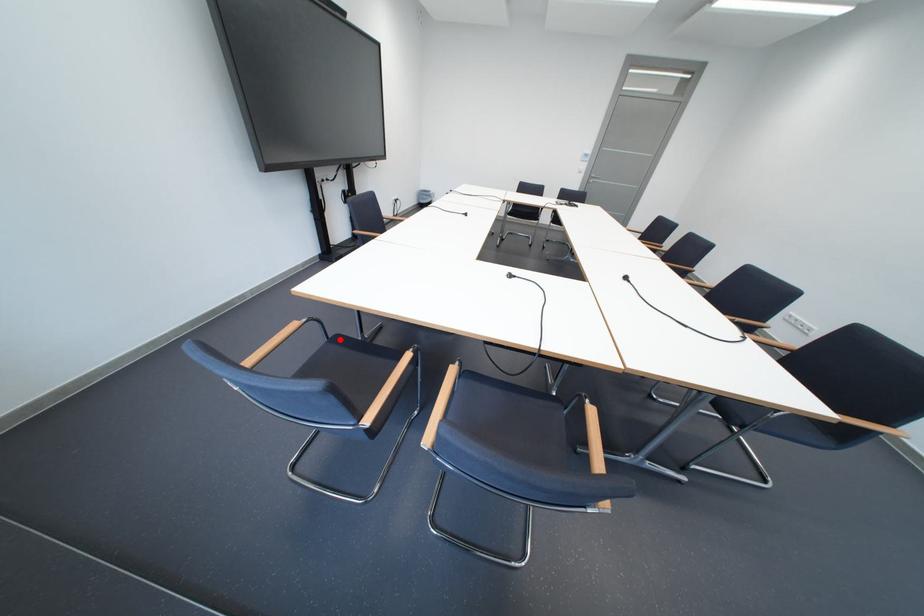
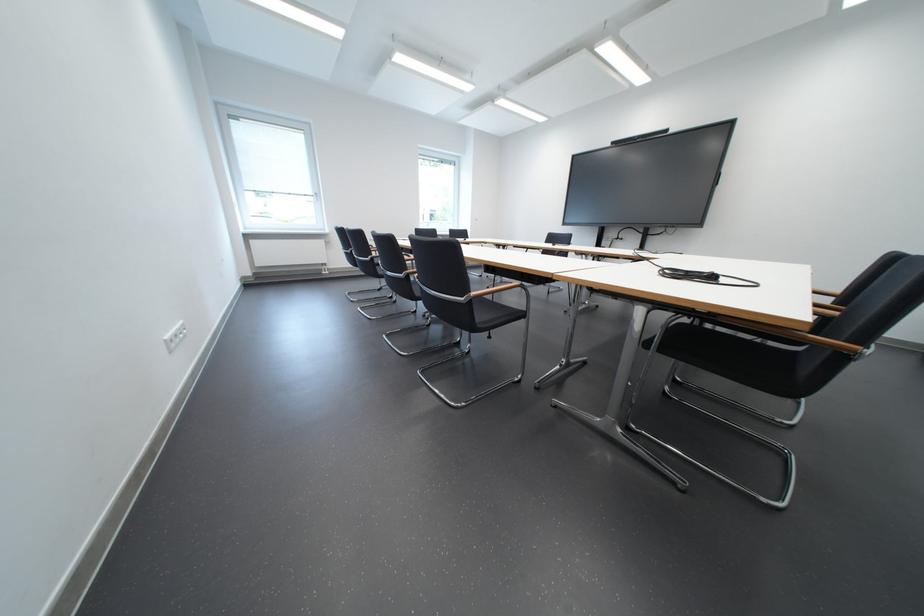
Question: I am providing you with two images of the same scene from different viewpoints. A red point is marked on the first image. Is the red point's position out of view in image 2?

Choices:
 (A) Yes
 (B) No

Answer: (A)